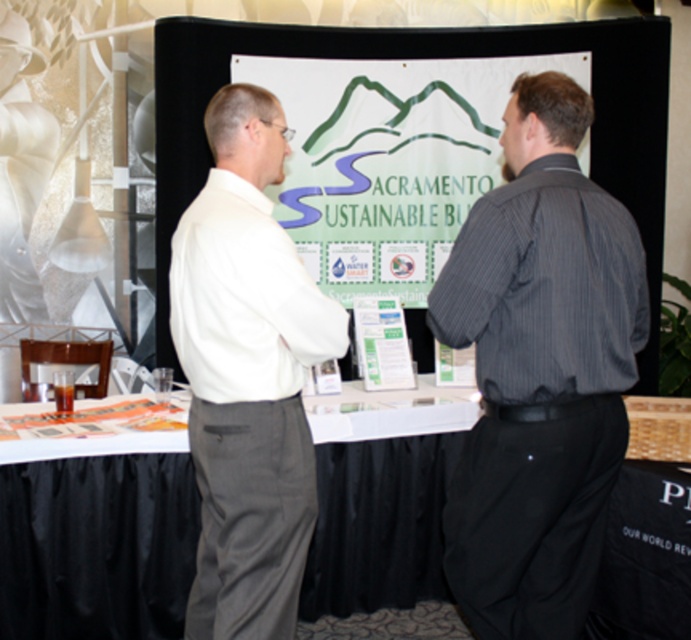
Who is shorter, dark gray striped shirt at center or white cotton shirt at center?

dark gray striped shirt at center

Can you confirm if dark gray striped shirt at center is wider than white cotton shirt at center?

Yes, dark gray striped shirt at center is wider than white cotton shirt at center.

Is point (598, 221) positioned after point (269, 177)?

No, (598, 221) is closer to viewer.

Locate an element on the screen. The height and width of the screenshot is (640, 691). dark gray striped shirt at center is located at coordinates (539, 371).

Can you confirm if dark gray striped shirt at center is positioned above white paper at center?

Result: Yes, dark gray striped shirt at center is above white paper at center.

Which is behind, point (530, 410) or point (428, 451)?

Positioned behind is point (428, 451).

Image resolution: width=691 pixels, height=640 pixels. I want to click on dark gray striped shirt at center, so click(539, 371).

Is point (346, 586) farther from camera compared to point (240, 440)?

Yes, it is behind point (240, 440).

Between white paper at center and white cotton shirt at center, which one has more height?

white cotton shirt at center

Between point (21, 547) and point (189, 442), which one is positioned in front?

Positioned in front is point (189, 442).

The image size is (691, 640). I want to click on white paper at center, so click(x=95, y=545).